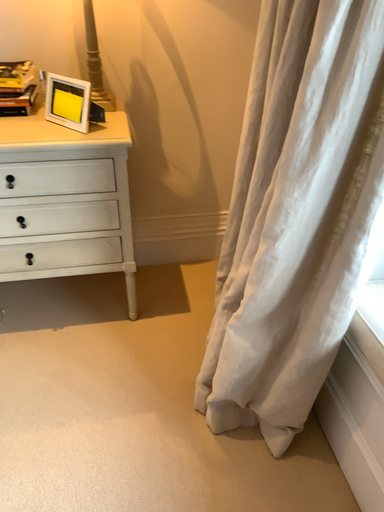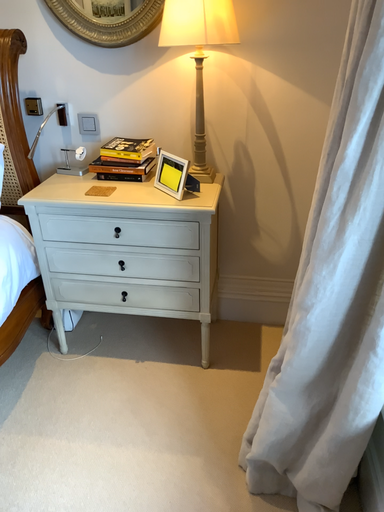
Question: Which way did the camera rotate in the video?

Choices:
 (A) rotated downward
 (B) rotated upward

Answer: (B)